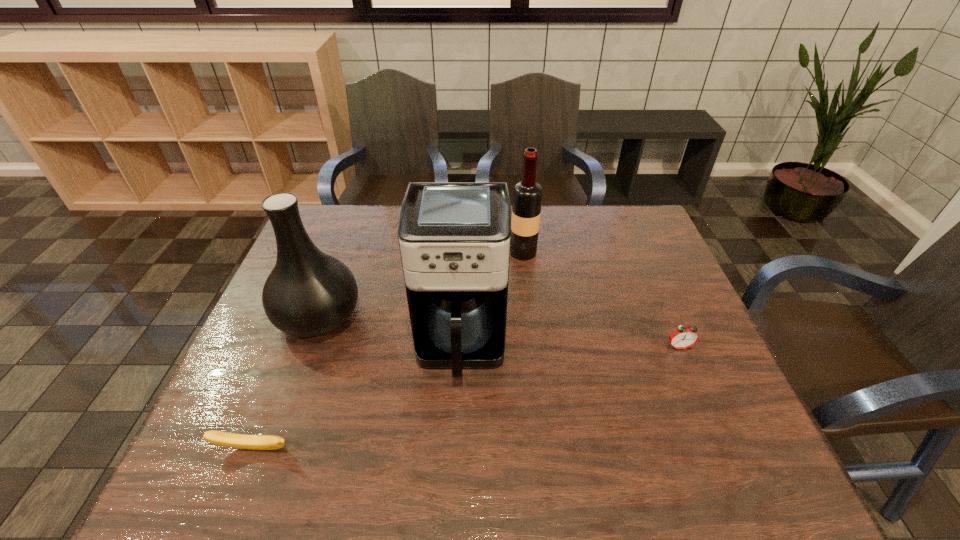
This screenshot has height=540, width=960. Find the location of `vacant region located 0.130m on the left of the farthest object`. vacant region located 0.130m on the left of the farthest object is located at coordinates (468, 252).

Identify the location of vacant space located 0.090m on the clock face of the second shortest object. 694,382.

Where is `object that is positioned at the far edge`? object that is positioned at the far edge is located at coordinates (527, 194).

Find the location of a particular element. This screenshot has height=540, width=960. object that is positioned at the near edge is located at coordinates (254, 442).

Locate an element on the screen. This screenshot has width=960, height=540. vase present at the left edge is located at coordinates (309, 293).

Image resolution: width=960 pixels, height=540 pixels. Find the location of `banana at the left edge`. banana at the left edge is located at coordinates [x=254, y=442].

Locate an element on the screen. The width and height of the screenshot is (960, 540). object that is at the right edge is located at coordinates (683, 337).

The image size is (960, 540). I want to click on object present at the near left corner, so click(x=254, y=442).

In the image, there is a desktop. Identify the location of vacant space at the far edge. This screenshot has height=540, width=960. (582, 232).

This screenshot has height=540, width=960. Identify the location of vacant space at the near edge of the desktop. (513, 467).